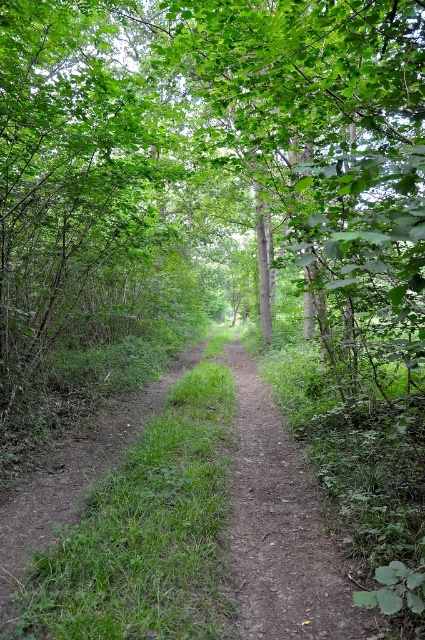
You are a hiker carrying a 2m wide tent. You need to set up camp along the path. Can you fit your tent on the dull brown dirt track at center or the dirt path at center?

The dull brown dirt track at center has a lesser width compared to dirt path at center. Therefore, the dirt path at center is wider and can accommodate the 2m wide tent, while the dull brown dirt track at center is too narrow.

You are a hiker walking along the forest path and notice two paths ahead. One is the dull brown dirt track at center and the other is the dirt path at center. Which path is positioned to the left?

The dull brown dirt track at center is to the left of the dirt path at center.